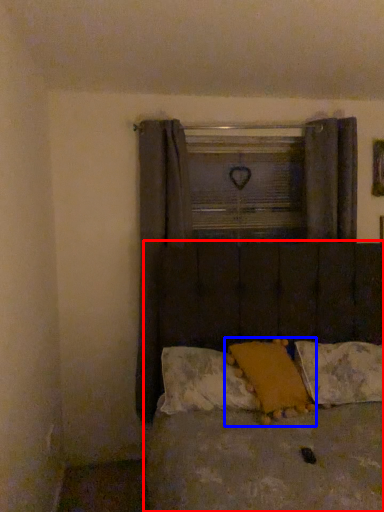
Question: Which object is closer to the camera taking this photo, bed (highlighted by a red box) or pillow (highlighted by a blue box)?

Choices:
 (A) bed
 (B) pillow

Answer: (A)